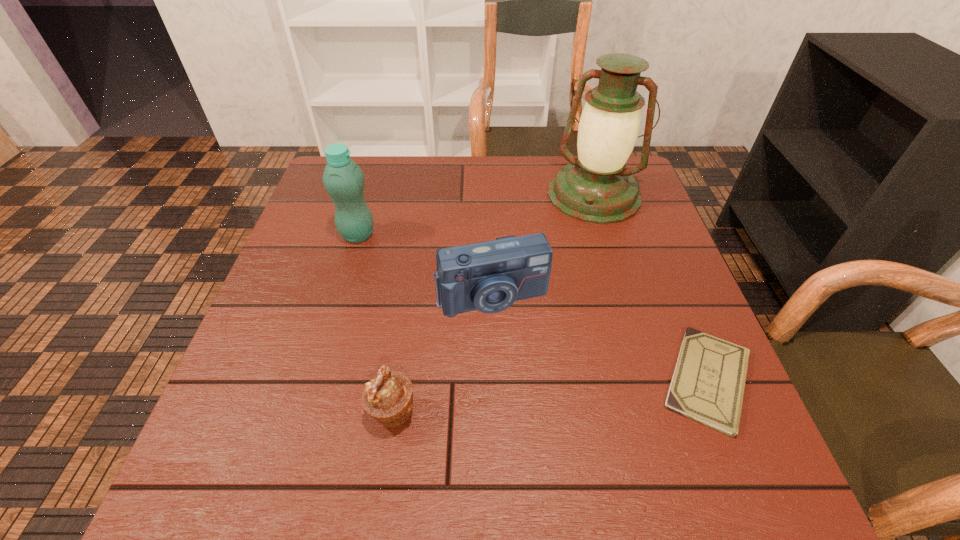
Where is `free space on the desktop that is between the muffin and the shortest object and is positioned on the lens of the camera`? The image size is (960, 540). free space on the desktop that is between the muffin and the shortest object and is positioned on the lens of the camera is located at coordinates tap(527, 399).

Where is `free space on the desktop that is between the second shortest object and the checkbook and is positioned at the front cap of the leftmost object`? The width and height of the screenshot is (960, 540). free space on the desktop that is between the second shortest object and the checkbook and is positioned at the front cap of the leftmost object is located at coordinates (580, 393).

Locate an element on the screen. Image resolution: width=960 pixels, height=540 pixels. vacant space on the desktop that is between the muffin and the checkbook and is positioned with the light compartment facing forward on the lantern is located at coordinates (513, 400).